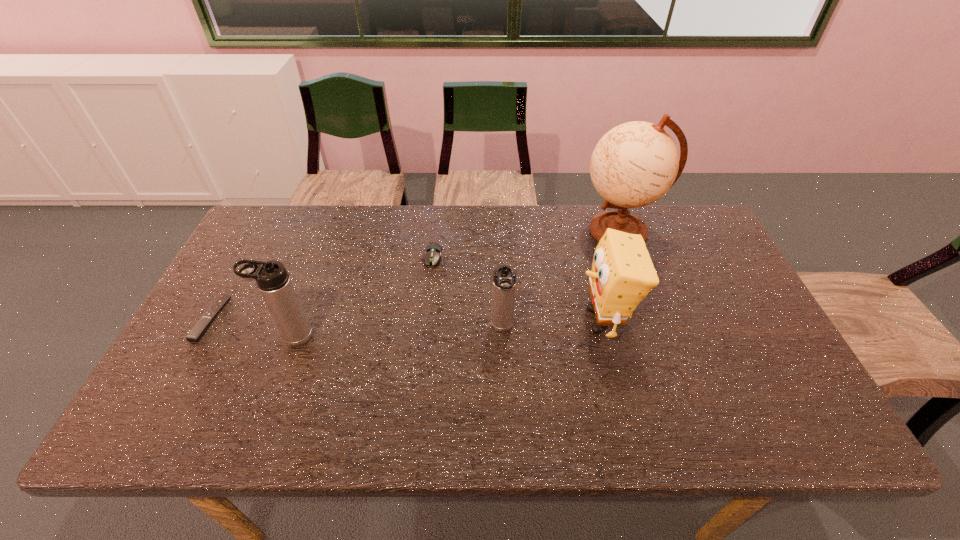
Where is `the fifth object from right to left`? The width and height of the screenshot is (960, 540). the fifth object from right to left is located at coordinates (274, 283).

Locate an element on the screen. This screenshot has width=960, height=540. the taller thermos bottle is located at coordinates point(274,283).

Identify the location of the shorter thermos bottle. This screenshot has width=960, height=540. (504, 280).

I want to click on the fourth object from left to right, so click(504, 280).

I want to click on the tallest object, so click(634, 164).

I want to click on the fourth object from right to left, so click(x=433, y=253).

This screenshot has height=540, width=960. Find the location of `the fifth tallest object`. the fifth tallest object is located at coordinates (433, 253).

Find the location of a particular element. The width and height of the screenshot is (960, 540). the shortest object is located at coordinates (200, 328).

Find the location of `the leftmost object`. the leftmost object is located at coordinates (200, 328).

The image size is (960, 540). I want to click on sponge, so click(622, 274).